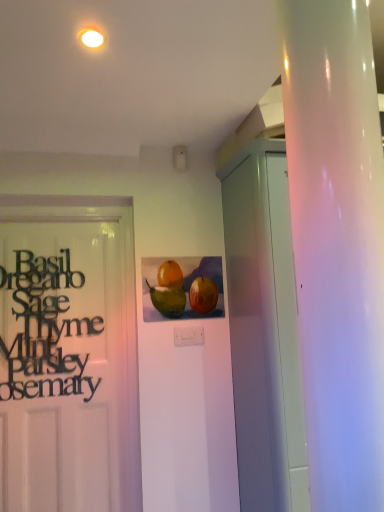
Question: Is black matte sign at left closer to camera compared to white glossy light fixture at upper center?

Choices:
 (A) no
 (B) yes

Answer: (A)

Question: Is the depth of black matte sign at left greater than that of white glossy light fixture at upper center?

Choices:
 (A) no
 (B) yes

Answer: (B)

Question: From the image's perspective, is black matte sign at left over white glossy light fixture at upper center?

Choices:
 (A) no
 (B) yes

Answer: (A)

Question: From the image's perspective, does black matte sign at left appear lower than white glossy light fixture at upper center?

Choices:
 (A) yes
 (B) no

Answer: (A)

Question: Is black matte sign at left directly adjacent to white glossy light fixture at upper center?

Choices:
 (A) no
 (B) yes

Answer: (A)

Question: Is black matte sign at left to the right of white glossy light fixture at upper center from the viewer's perspective?

Choices:
 (A) no
 (B) yes

Answer: (A)

Question: Does white glossy light fixture at upper center have a lesser height compared to watercolor painting of fruits at center?

Choices:
 (A) yes
 (B) no

Answer: (A)

Question: From a real-world perspective, is white glossy light fixture at upper center positioned under watercolor painting of fruits at center based on gravity?

Choices:
 (A) no
 (B) yes

Answer: (A)

Question: Is watercolor painting of fruits at center located within white glossy light fixture at upper center?

Choices:
 (A) no
 (B) yes

Answer: (A)

Question: Considering the relative sizes of white glossy light fixture at upper center and watercolor painting of fruits at center in the image provided, is white glossy light fixture at upper center smaller than watercolor painting of fruits at center?

Choices:
 (A) yes
 (B) no

Answer: (A)

Question: Is watercolor painting of fruits at center at the back of white glossy light fixture at upper center?

Choices:
 (A) no
 (B) yes

Answer: (A)

Question: From a real-world perspective, is white glossy light fixture at upper center over watercolor painting of fruits at center?

Choices:
 (A) yes
 (B) no

Answer: (A)

Question: Would you consider white glossy cabinet at right to be distant from watercolor painting of fruits at center?

Choices:
 (A) no
 (B) yes

Answer: (A)